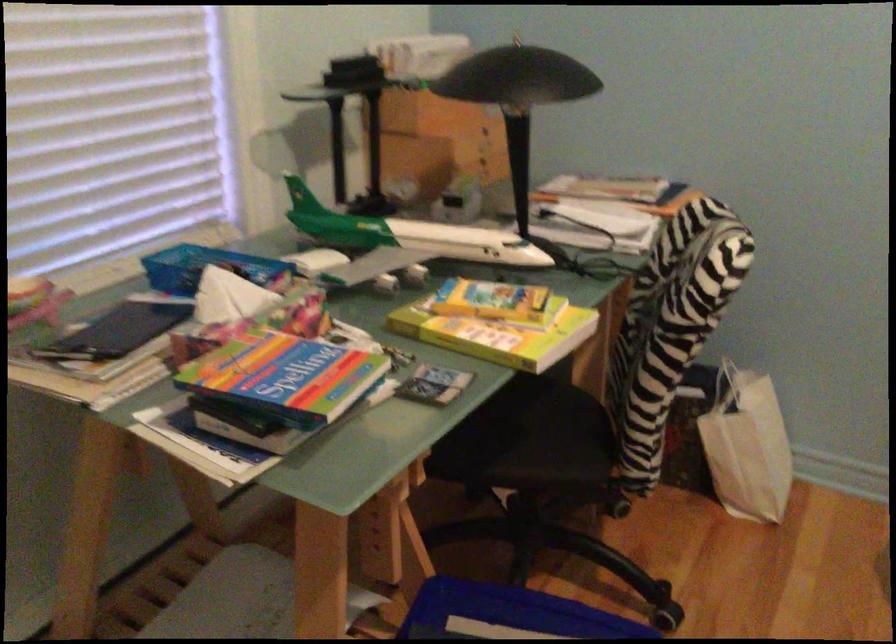
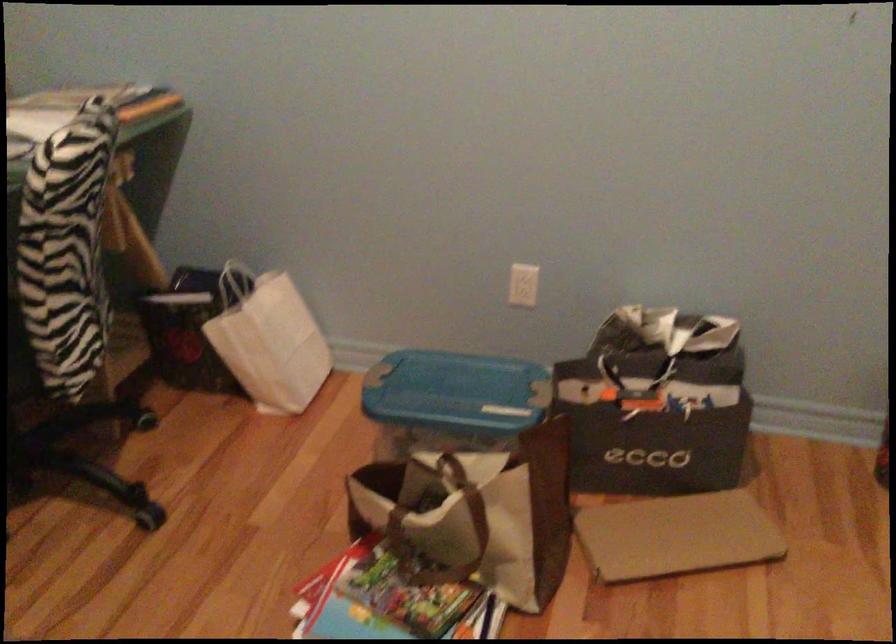
Question: The first image is from the beginning of the video and the second image is from the end. How did the camera likely rotate when shooting the video?

Choices:
 (A) Left
 (B) Right
 (C) Up
 (D) Down

Answer: (B)